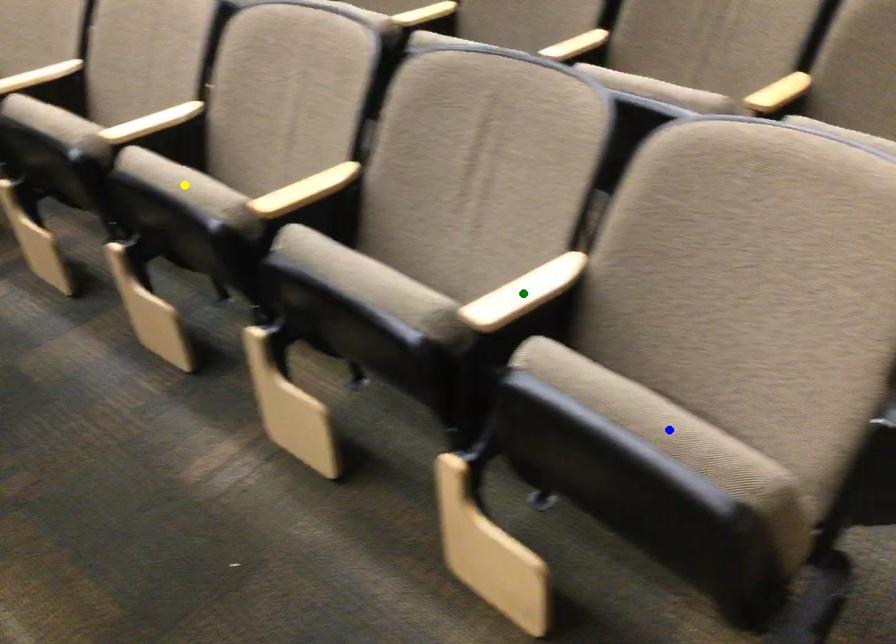
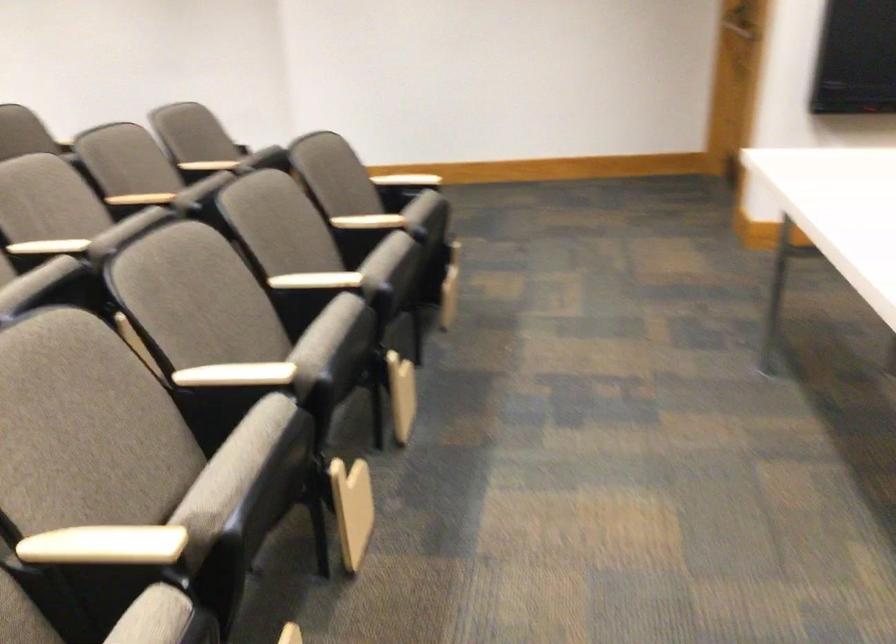
I am providing you with two images of the same scene from different viewpoints. Three points are marked in image1. Which point corresponds to a part or object that is occluded in image2?In image1, three points are marked. Which of them correspond to a part or object that is occluded in image2?Among the three points shown in image1, which one corresponds to a part or object that is no longer visible due to occlusion in image2?

Invisible in image2: blue point, green point, yellow point.